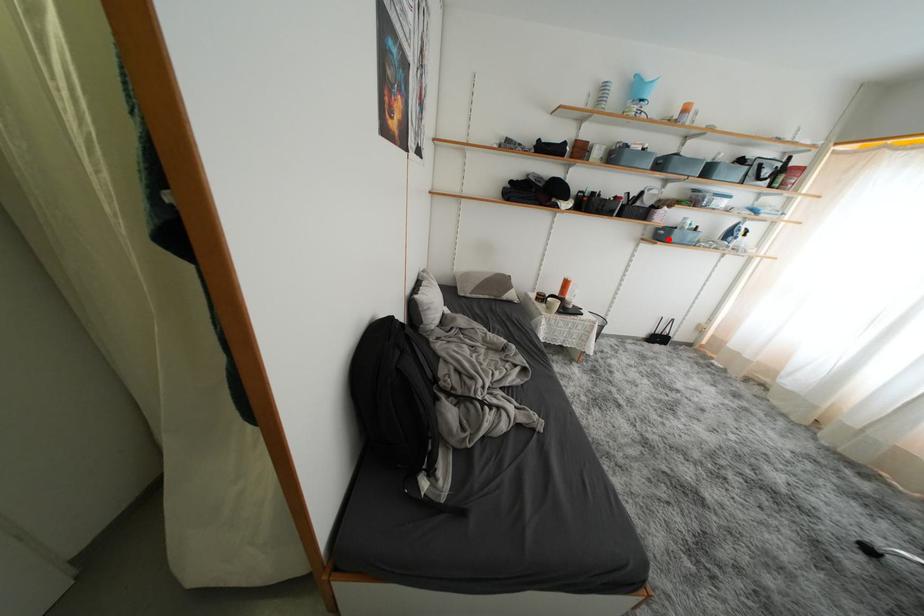
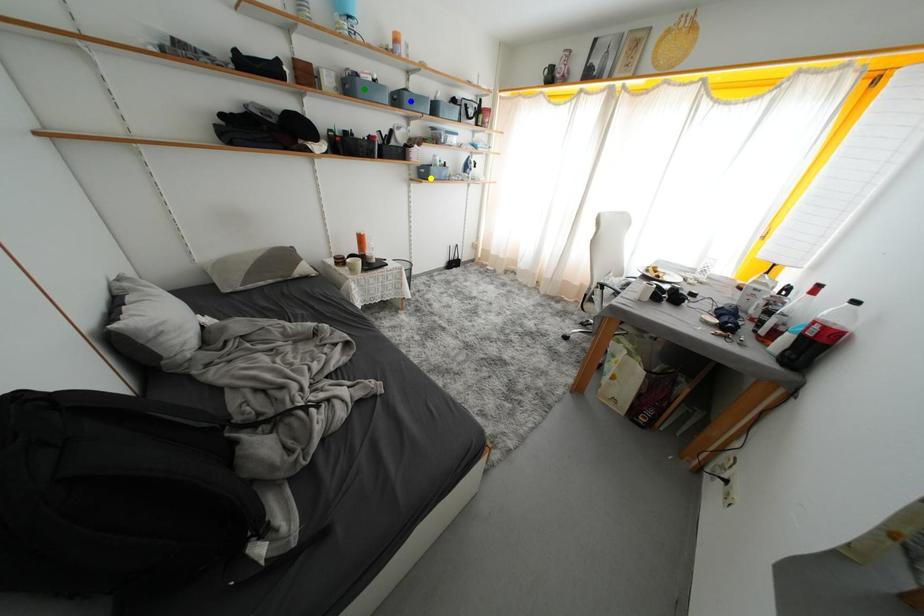
Question: I am providing you with two images of the same scene from different viewpoints. A red point is marked on the first image. You are given multiple points on the second image. In image 2, which mark is for the same physical point as the one in image 1?

Choices:
 (A) green point
 (B) blue point
 (C) yellow point

Answer: (C)